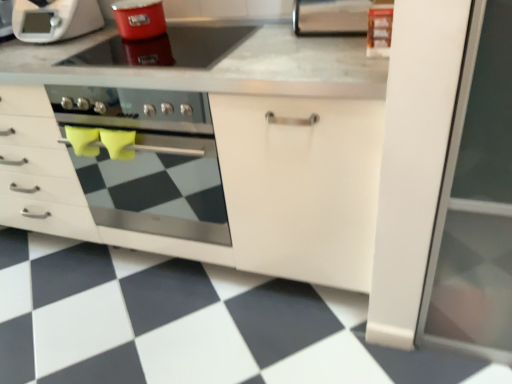
The height and width of the screenshot is (384, 512). What do you see at coordinates (210, 185) in the screenshot? I see `white matte cabinet at center` at bounding box center [210, 185].

Locate an element on the screen. Image resolution: width=512 pixels, height=384 pixels. shiny red pot at upper center is located at coordinates (166, 48).

In the scene shown: Based on their positions, is stainless steel oven at center located to the left or right of white matte microwave at upper left?

Based on their positions, stainless steel oven at center is located to the right of white matte microwave at upper left.

Could you tell me if stainless steel oven at center is turned towards white matte microwave at upper left?

No.

Consider the image. Is stainless steel oven at center completely or partially outside of white matte microwave at upper left?

Yes, stainless steel oven at center is outside of white matte microwave at upper left.

In the scene shown: From the image's perspective, is stainless steel oven at center below white matte microwave at upper left?

Yes, from the image's perspective, stainless steel oven at center is below white matte microwave at upper left.

Considering the sizes of stainless steel oven at center and white matte cabinet at center in the image, is stainless steel oven at center wider or thinner than white matte cabinet at center?

Considering their sizes, stainless steel oven at center looks slimmer than white matte cabinet at center.

Is stainless steel oven at center turned away from white matte cabinet at center?

Absolutely, stainless steel oven at center is directed away from white matte cabinet at center.

Can you confirm if stainless steel oven at center is positioned to the left of white matte cabinet at center?

No.

Looking at this image, from their relative heights in the image, would you say stainless steel oven at center is taller or shorter than white matte cabinet at center?

stainless steel oven at center is shorter than white matte cabinet at center.

Does white matte microwave at upper left have a larger size compared to shiny red pot at upper center?

Yes, white matte microwave at upper left is bigger than shiny red pot at upper center.

This screenshot has height=384, width=512. Find the location of `gas stove lying below the white matte microwave at upper left (from the image's perspective)`. gas stove lying below the white matte microwave at upper left (from the image's perspective) is located at coordinates (166, 48).

Can we say white matte microwave at upper left lies outside shiny red pot at upper center?

white matte microwave at upper left is positioned outside shiny red pot at upper center.

Does white matte microwave at upper left have a lesser height compared to shiny red pot at upper center?

No, white matte microwave at upper left is not shorter than shiny red pot at upper center.

Considering the sizes of objects stainless steel oven at center and shiny red pot at upper center in the image provided, who is shorter, stainless steel oven at center or shiny red pot at upper center?

With less height is shiny red pot at upper center.

Is the depth of stainless steel oven at center greater than that of shiny red pot at upper center?

No, it is in front of shiny red pot at upper center.

Is stainless steel oven at center to the left of shiny red pot at upper center from the viewer's perspective?

In fact, stainless steel oven at center is to the right of shiny red pot at upper center.

Measure the distance between stainless steel oven at center and shiny red pot at upper center.

stainless steel oven at center and shiny red pot at upper center are 33.01 inches apart.

Is matte red pot at upper center thinner than shiny red pot at upper center?

Yes, matte red pot at upper center is thinner than shiny red pot at upper center.

Looking at this image, is matte red pot at upper center touching shiny red pot at upper center?

matte red pot at upper center and shiny red pot at upper center are clearly separated.

Looking at this image, would you say matte red pot at upper center is to the left or to the right of shiny red pot at upper center in the picture?

matte red pot at upper center is positioned on shiny red pot at upper center's left side.

Is matte red pot at upper center oriented away from shiny red pot at upper center?

No, matte red pot at upper center is not facing away from shiny red pot at upper center.

Consider the image. From the image's perspective, is stainless steel oven at center on top of metallic stainless steel paper towel holder at upper center?

No.

Can you confirm if stainless steel oven at center is wider than metallic stainless steel paper towel holder at upper center?

Correct, the width of stainless steel oven at center exceeds that of metallic stainless steel paper towel holder at upper center.

From the picture: Is stainless steel oven at center in contact with metallic stainless steel paper towel holder at upper center?

stainless steel oven at center and metallic stainless steel paper towel holder at upper center are clearly separated.

Does stainless steel oven at center have a larger size compared to metallic stainless steel paper towel holder at upper center?

Correct, stainless steel oven at center is larger in size than metallic stainless steel paper towel holder at upper center.

Is white matte microwave at upper left inside the boundaries of stainless steel oven at center, or outside?

white matte microwave at upper left is not enclosed by stainless steel oven at center.

Is white matte microwave at upper left positioned with its back to stainless steel oven at center?

That's not correct — white matte microwave at upper left is not looking away from stainless steel oven at center.

Find the location of a particular element. Image resolution: width=512 pixels, height=384 pixels. oven below the white matte microwave at upper left (from a real-world perspective) is located at coordinates (150, 161).

Are white matte microwave at upper left and stainless steel oven at center far apart?

They are positioned close to each other.

You are a GUI agent. You are given a task and a screenshot of the screen. Output one action in this format:
    pyautogui.click(x=<x>, y=<y>)
    Task: Click on the oven below the white matte microwave at upper left (from a real-world perspective)
    The width and height of the screenshot is (512, 384).
    Given the screenshot: What is the action you would take?
    pyautogui.click(x=150, y=161)

Locate an element on the screen. The height and width of the screenshot is (384, 512). cabinetry in front of the stainless steel oven at center is located at coordinates (210, 185).

Based on their spatial positions, is white matte microwave at upper left or matte red pot at upper center further from shiny red pot at upper center?

white matte microwave at upper left lies further to shiny red pot at upper center than the other object.

Looking at the image, which one is located further to white matte cabinet at center, metallic stainless steel paper towel holder at upper center or stainless steel oven at center?

metallic stainless steel paper towel holder at upper center lies further to white matte cabinet at center than the other object.

Considering their positions, is metallic stainless steel paper towel holder at upper center positioned further to matte red pot at upper center than white matte microwave at upper left?

metallic stainless steel paper towel holder at upper center is positioned further to the anchor matte red pot at upper center.

Estimate the real-world distances between objects in this image. Which object is further from white matte cabinet at center, stainless steel oven at center or shiny red pot at upper center?

Based on the image, stainless steel oven at center appears to be further to white matte cabinet at center.

From the image, which object appears to be farther from white matte cabinet at center, stainless steel oven at center or white matte microwave at upper left?

white matte microwave at upper left.

Estimate the real-world distances between objects in this image. Which object is closer to matte red pot at upper center, stainless steel oven at center or white matte cabinet at center?

white matte cabinet at center.

Which object lies nearer to the anchor point white matte cabinet at center, white matte microwave at upper left or metallic stainless steel paper towel holder at upper center?

Among the two, white matte microwave at upper left is located nearer to white matte cabinet at center.

Considering their positions, is shiny red pot at upper center positioned further to white matte microwave at upper left than metallic stainless steel paper towel holder at upper center?

metallic stainless steel paper towel holder at upper center is positioned further to the anchor white matte microwave at upper left.

You are a GUI agent. You are given a task and a screenshot of the screen. Output one action in this format:
    pyautogui.click(x=<x>, y=<y>)
    Task: Click on the gas stove between white matte cabinet at center and white matte microwave at upper left in the front-back direction
    
    Given the screenshot: What is the action you would take?
    pyautogui.click(x=166, y=48)

I want to click on kitchen appliance located between white matte cabinet at center and white matte microwave at upper left in the depth direction, so click(x=139, y=18).

This screenshot has width=512, height=384. Find the location of `gas stove situated between white matte microwave at upper left and metallic stainless steel paper towel holder at upper center from left to right`. gas stove situated between white matte microwave at upper left and metallic stainless steel paper towel holder at upper center from left to right is located at coordinates (166, 48).

Locate an element on the screen. cabinetry between white matte microwave at upper left and metallic stainless steel paper towel holder at upper center in the horizontal direction is located at coordinates (210, 185).